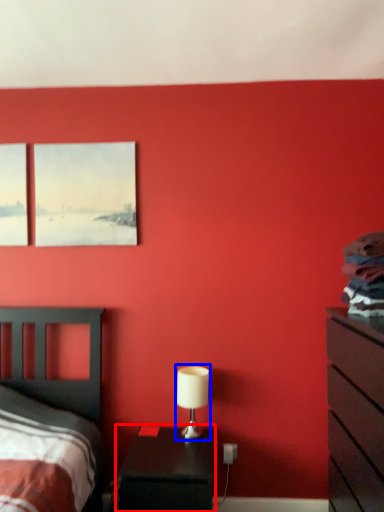
Question: Which object is closer to the camera taking this photo, nightstand (highlighted by a red box) or table lamp (highlighted by a blue box)?

Choices:
 (A) nightstand
 (B) table lamp

Answer: (A)